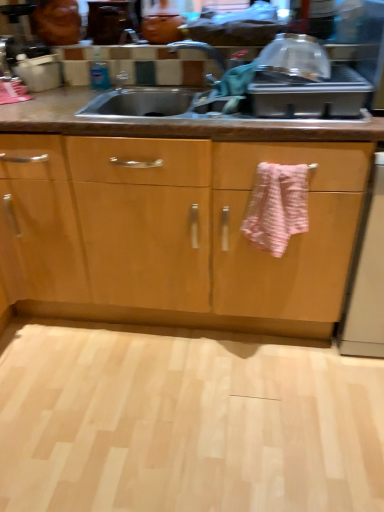
Locate an element on the screen. The image size is (384, 512). free spot above light wood floor at lower center (from a real-world perspective) is located at coordinates (170, 417).